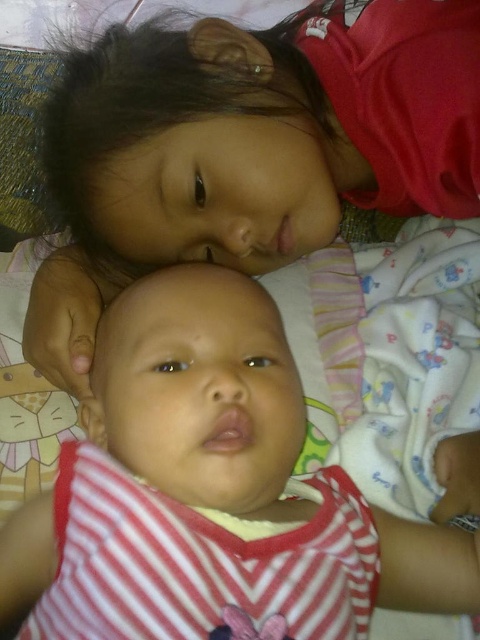
Question: Does matte red shirt at upper center have a lesser width compared to striped fabric baby at center?

Choices:
 (A) no
 (B) yes

Answer: (A)

Question: Is matte red shirt at upper center positioned before striped fabric baby at center?

Choices:
 (A) no
 (B) yes

Answer: (A)

Question: Which point is closer to the camera taking this photo?

Choices:
 (A) (x=312, y=20)
 (B) (x=36, y=630)

Answer: (B)

Question: Which object appears farthest from the camera in this image?

Choices:
 (A) striped fabric baby at center
 (B) matte red shirt at upper center

Answer: (B)

Question: Is matte red shirt at upper center bigger than striped fabric baby at center?

Choices:
 (A) no
 (B) yes

Answer: (B)